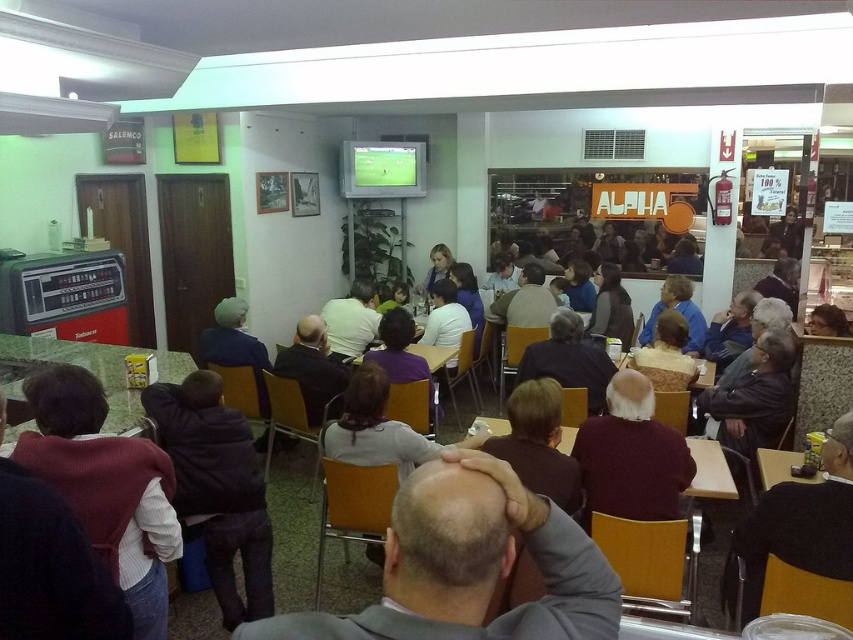
Question: Which point appears farthest from the camera in this image?

Choices:
 (A) (352, 332)
 (B) (578, 429)

Answer: (A)

Question: Can you confirm if white shirt at center is wider than wooden table at lower right?

Choices:
 (A) yes
 (B) no

Answer: (A)

Question: Which object appears closest to the camera in this image?

Choices:
 (A) dark brown hair at center
 (B) white shirt at center
 (C) matte plastic table at lower left

Answer: (A)

Question: Does gray suit at center come in front of maroon sweater at center?

Choices:
 (A) yes
 (B) no

Answer: (A)

Question: Which of the following is the farthest from the observer?

Choices:
 (A) wooden table at lower right
 (B) matte plastic table at lower left
 (C) dark brown hair at center

Answer: (A)

Question: Is gray suit at center to the right of wooden table at center from the viewer's perspective?

Choices:
 (A) yes
 (B) no

Answer: (A)